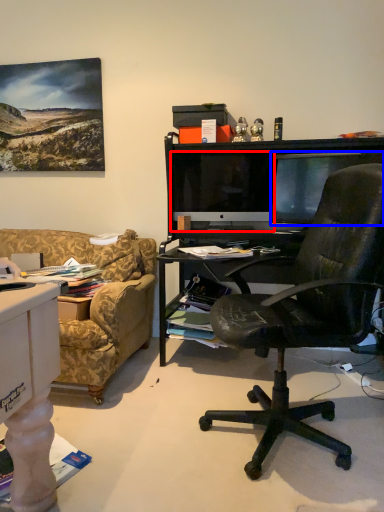
Question: Which of the following is the closest to the observer, computer monitor (highlighted by a red box) or television (highlighted by a blue box)?

Choices:
 (A) computer monitor
 (B) television

Answer: (B)